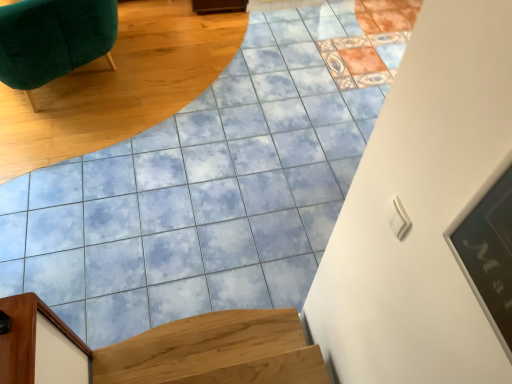
At what (x,y) coordinates should I click in order to perform the action: click on free spot in front of velvet green chair at upper left, which is counted as the 1th furniture, starting from the back. Please return your answer as a coordinate pair (x, y). Looking at the image, I should click on (67, 165).